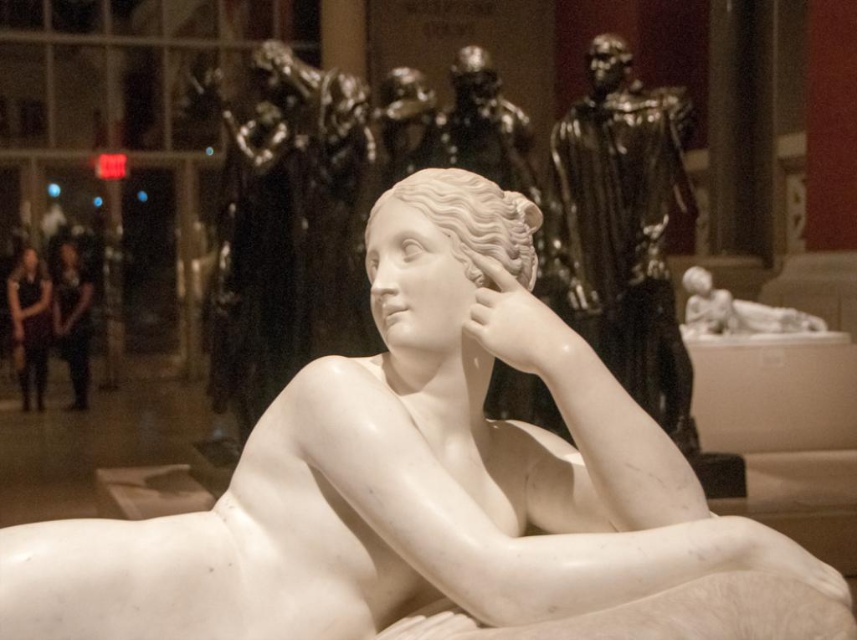
You are standing in front of the marble sculpture of the reclining female figure. There are two points marked on the sculpture, one at coordinates point (x=634, y=440) and the other at point (x=37, y=346). Which point is nearer to you?

Point (x=634, y=440) is closer to the viewer than point (x=37, y=346).

You are an interior designer planning to place the white marble statue at center and the matte black dress at left in a narrow hallway. Given their sizes, which object should be placed closer to the wall to save space?

The matte black dress at left should be placed closer to the wall since it is narrower than the white marble statue at center, allowing more space in the hallway.